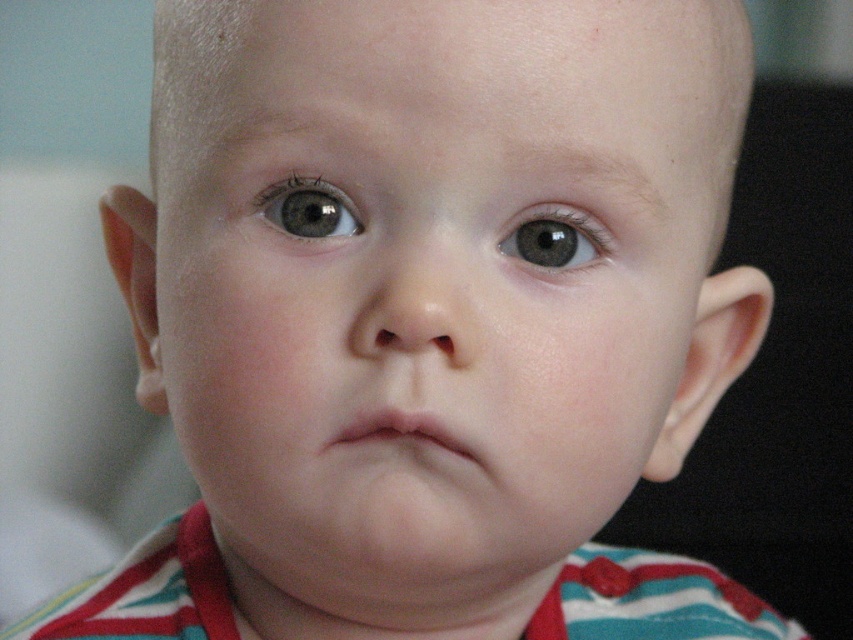
Question: Which is farther from the gray matte eye at center?

Choices:
 (A) matte gray eye at upper center
 (B) smooth skin face at center

Answer: (B)

Question: Which of the following is the farthest from the observer?

Choices:
 (A) (x=544, y=218)
 (B) (x=331, y=216)

Answer: (A)

Question: Does smooth skin face at center have a larger size compared to matte gray eye at upper center?

Choices:
 (A) no
 (B) yes

Answer: (B)

Question: Can you confirm if matte gray eye at upper center is positioned to the right of gray matte eye at center?

Choices:
 (A) no
 (B) yes

Answer: (A)

Question: From the image, what is the correct spatial relationship of smooth skin face at center in relation to matte gray eye at upper center?

Choices:
 (A) below
 (B) above

Answer: (A)

Question: Which point is farther from the camera taking this photo?

Choices:
 (A) (277, 216)
 (B) (467, 264)

Answer: (A)